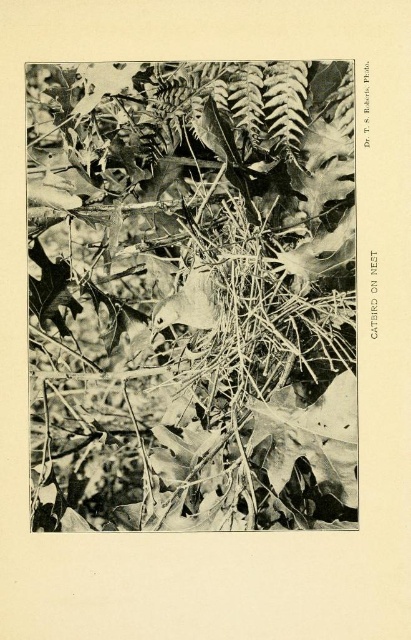
You are a wildlife photographer trying to capture a closeup of the smooth gray bird at center. The brown textured nest at center is blocking your view. Can you estimate whether the nest is wider than the bird to determine if moving the camera position might help?

The brown textured nest at center is wider than the smooth gray bird at center, so moving the camera position might help to avoid the nest blocking the view.

You are a birdwatcher trying to observe the smooth gray bird at center. Since the brown textured nest at center is blocking your view, can you determine if you can see the bird clearly through the nest?

The brown textured nest at center is in front of the smooth gray bird at center, so the nest is blocking the view of the bird. Therefore, you cannot see the smooth gray bird at center clearly through the nest.